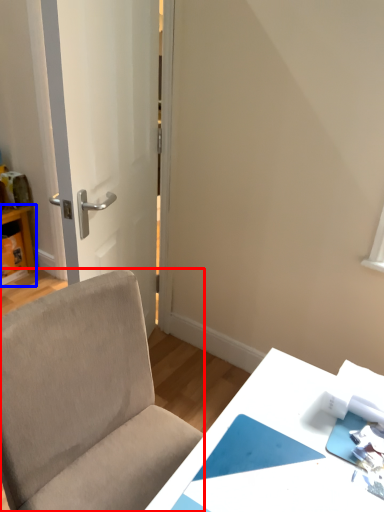
Question: Which of the following is the closest to the observer, chair (highlighted by a red box) or table (highlighted by a blue box)?

Choices:
 (A) chair
 (B) table

Answer: (A)